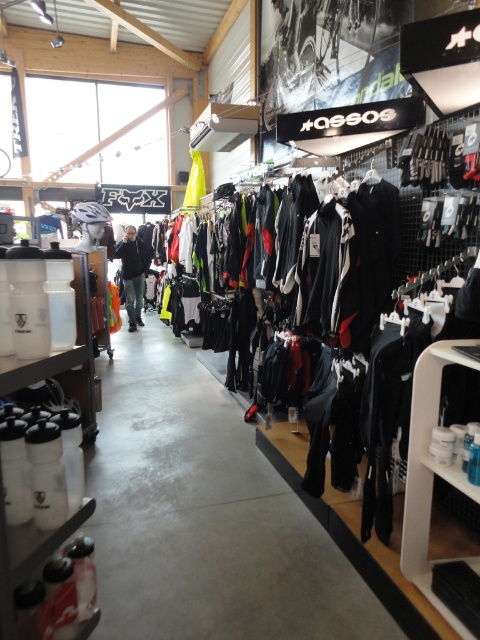
Question: Does white plastic bottles at lower right have a smaller size compared to dark gray jacket at center?

Choices:
 (A) no
 (B) yes

Answer: (B)

Question: Which point appears farthest from the camera in this image?

Choices:
 (A) (126, 266)
 (B) (452, 621)

Answer: (A)

Question: Can you confirm if white plastic bottles at lower right is bigger than dark gray jacket at center?

Choices:
 (A) no
 (B) yes

Answer: (A)

Question: Which object appears farthest from the camera in this image?

Choices:
 (A) dark gray jacket at center
 (B) white plastic bottles at lower right

Answer: (A)

Question: Which point is closer to the camera?

Choices:
 (A) white plastic bottles at lower right
 (B) dark gray jacket at center

Answer: (A)

Question: Where is white plastic bottles at lower right located in relation to dark gray jacket at center in the image?

Choices:
 (A) left
 (B) right

Answer: (B)